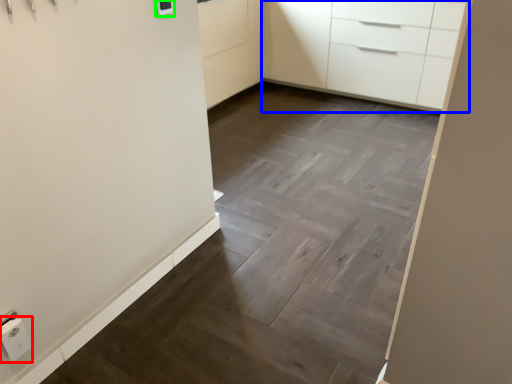
Question: Estimate the real-world distances between objects in this image. Which object is closer to electric outlet (highlighted by a red box), chest of drawers (highlighted by a blue box) or light switch (highlighted by a green box)?

Choices:
 (A) chest of drawers
 (B) light switch

Answer: (B)